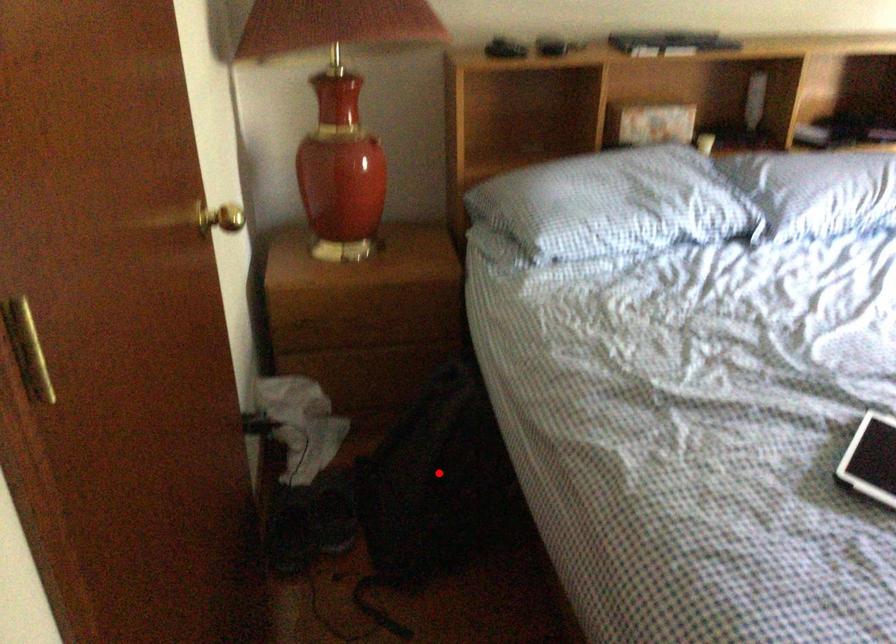
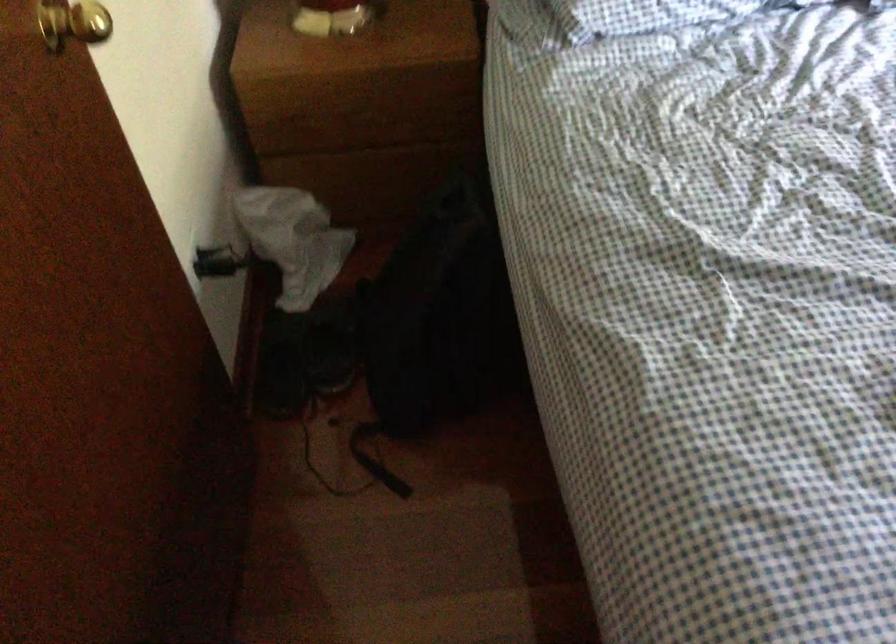
Question: I am providing you with two images of the same scene from different viewpoints. A red point is shown in image1. For the corresponding object point in image2, is it positioned nearer or farther from the camera?

Choices:
 (A) Nearer
 (B) Farther

Answer: (A)